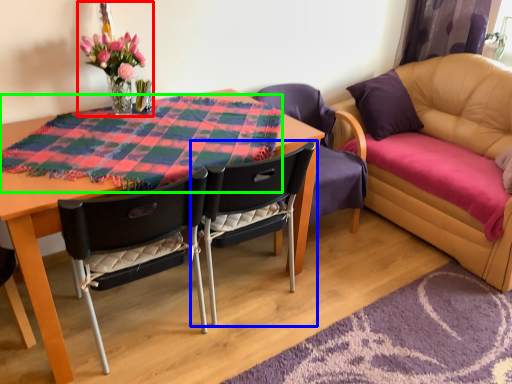
Question: Estimate the real-world distances between objects in this image. Which object is closer to floral arrangement (highlighted by a red box), chair (highlighted by a blue box) or cloth (highlighted by a green box)?

Choices:
 (A) chair
 (B) cloth

Answer: (B)